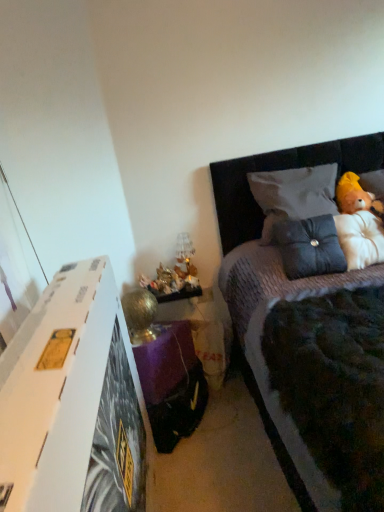
Measure the distance between point (18, 382) and camera.

They are 30.55 inches apart.

The height and width of the screenshot is (512, 384). Describe the element at coordinates (73, 402) in the screenshot. I see `white cardboard at left` at that location.

What do you see at coordinates (185, 255) in the screenshot?
I see `translucent glass lamp at lower center` at bounding box center [185, 255].

In order to face suede-like black pillow at upper right, which ranks as the second pillow in top-to-bottom order, should I rotate leftwards or rightwards?

You should look right and rotate roughly 15.401 degrees.

You are a GUI agent. You are given a task and a screenshot of the screen. Output one action in this format:
    pyautogui.click(x=<x>, y=<y>)
    Task: Click on the white cardboard at left
    Image resolution: width=384 pixels, height=512 pixels.
    Given the screenshot: What is the action you would take?
    pyautogui.click(x=73, y=402)

Is white cardboard at left further to the viewer compared to dark gray textured pillow at upper right, which is counted as the 1th pillow, starting from the top?

No, the depth of white cardboard at left is less than that of dark gray textured pillow at upper right, which is counted as the 1th pillow, starting from the top.

Considering the positions of point (139, 431) and point (271, 208), is point (139, 431) closer or farther from the camera than point (271, 208)?

Point (139, 431) appears to be closer to the viewer than point (271, 208).

Is white cardboard at left looking in the opposite direction of dark gray textured pillow at upper right, which is counted as the 1th pillow, starting from the top?

No.

From a real-world perspective, does white cardboard at left stand above dark gray textured pillow at upper right, which is counted as the 2th pillow, starting from the bottom?

Actually, white cardboard at left is physically below dark gray textured pillow at upper right, which is counted as the 2th pillow, starting from the bottom, in the real world.

Would you say fluffy white teddy bear at upper right is a long distance from translucent glass lamp at lower center?

No.

Between point (347, 174) and point (191, 267), which one is positioned behind?

The point (191, 267) is behind.

Looking at this image, is fluffy white teddy bear at upper right to the right of translucent glass lamp at lower center from the viewer's perspective?

Indeed, fluffy white teddy bear at upper right is positioned on the right side of translucent glass lamp at lower center.

Identify the location of lamp that is below the fluffy white teddy bear at upper right (from the image's perspective). (185, 255).

From a real-world perspective, which object stands above the other?

dark gray textured pillow at upper right, which is counted as the 1th pillow, starting from the top, from a real-world perspective.

Find the location of `the 2nd pillow directly above the translucent glass lamp at lower center (from a real-world perspective)`. the 2nd pillow directly above the translucent glass lamp at lower center (from a real-world perspective) is located at coordinates (296, 191).

Which is less distant, (190,266) or (290,185)?

Point (190,266).

Is fluffy white teddy bear at upper right far away from dark gray textured pillow at upper right, which is counted as the 2th pillow, starting from the bottom?

No, fluffy white teddy bear at upper right is not far away from dark gray textured pillow at upper right, which is counted as the 2th pillow, starting from the bottom.

Which object is further away from the camera taking this photo, fluffy white teddy bear at upper right or dark gray textured pillow at upper right, which is counted as the 2th pillow, starting from the bottom?

dark gray textured pillow at upper right, which is counted as the 2th pillow, starting from the bottom, is behind.

How many degrees apart are the facing directions of fluffy white teddy bear at upper right and dark gray textured pillow at upper right, which is counted as the 1th pillow, starting from the top?

The angular difference between fluffy white teddy bear at upper right and dark gray textured pillow at upper right, which is counted as the 1th pillow, starting from the top, is 0.0244 degrees.

At what (x,y) coordinates should I click in order to perform the action: click on pillow behind the fluffy white teddy bear at upper right. Please return your answer as a coordinate pair (x, y). Looking at the image, I should click on (296, 191).

Does translucent glass lamp at lower center have a larger size compared to velvet grey bed at upper right?

Actually, translucent glass lamp at lower center might be smaller than velvet grey bed at upper right.

Between translucent glass lamp at lower center and velvet grey bed at upper right, which one is positioned in front?

Positioned in front is velvet grey bed at upper right.

Is translucent glass lamp at lower center oriented towards velvet grey bed at upper right?

No.

From the image's perspective, who appears lower, fluffy white teddy bear at upper right or suede-like black pillow at upper right, positioned as the 1th pillow in bottom-to-top order?

suede-like black pillow at upper right, positioned as the 1th pillow in bottom-to-top order, is shown below in the image.

Is fluffy white teddy bear at upper right directly adjacent to suede-like black pillow at upper right, which ranks as the second pillow in top-to-bottom order?

They are not placed beside each other.

Could you tell me if fluffy white teddy bear at upper right is turned towards suede-like black pillow at upper right, positioned as the 1th pillow in bottom-to-top order?

No, fluffy white teddy bear at upper right is not aimed at suede-like black pillow at upper right, positioned as the 1th pillow in bottom-to-top order.

Is point (321, 240) behind point (181, 262)?

No, it is in front of (181, 262).

From the image's perspective, which one is positioned higher, suede-like black pillow at upper right, which ranks as the second pillow in top-to-bottom order, or translucent glass lamp at lower center?

suede-like black pillow at upper right, which ranks as the second pillow in top-to-bottom order, from the image's perspective.

Which pillow is the 1st one when counting from the right side of the translucent glass lamp at lower center? Please provide its 2D coordinates.

[(309, 247)]

Can you tell me how much suede-like black pillow at upper right, which ranks as the second pillow in top-to-bottom order, and translucent glass lamp at lower center differ in facing direction?

There is a 1.36-degree angle between the facing directions of suede-like black pillow at upper right, which ranks as the second pillow in top-to-bottom order, and translucent glass lamp at lower center.

Identify the location of nightstand in front of the dark gray textured pillow at upper right, which is counted as the 1th pillow, starting from the top. The height and width of the screenshot is (512, 384). (73, 402).

Where is `doll located above the translucent glass lamp at lower center (from a real-world perspective)`? The image size is (384, 512). doll located above the translucent glass lamp at lower center (from a real-world perspective) is located at coordinates (358, 224).

Which object lies nearer to the anchor point translucent glass lamp at lower center, dark gray textured pillow at upper right, which is counted as the 2th pillow, starting from the bottom, or velvet grey bed at upper right?

velvet grey bed at upper right is positioned closer to the anchor translucent glass lamp at lower center.

When comparing their distances from white cardboard at left, does fluffy white teddy bear at upper right or velvet grey bed at upper right seem closer?

velvet grey bed at upper right lies closer to white cardboard at left than the other object.

Considering their positions, is white cardboard at left positioned closer to translucent glass lamp at lower center than suede-like black pillow at upper right, which ranks as the second pillow in top-to-bottom order?

suede-like black pillow at upper right, which ranks as the second pillow in top-to-bottom order.

Based on their spatial positions, is fluffy white teddy bear at upper right or suede-like black pillow at upper right, which ranks as the second pillow in top-to-bottom order, further from dark gray textured pillow at upper right, which is counted as the 2th pillow, starting from the bottom?

Based on the image, fluffy white teddy bear at upper right appears to be further to dark gray textured pillow at upper right, which is counted as the 2th pillow, starting from the bottom.

Which object lies nearer to the anchor point white cardboard at left, translucent glass lamp at lower center or fluffy white teddy bear at upper right?

translucent glass lamp at lower center is closer to white cardboard at left.

Based on the photo, when comparing their distances from fluffy white teddy bear at upper right, does suede-like black pillow at upper right, which ranks as the second pillow in top-to-bottom order, or translucent glass lamp at lower center seem closer?

suede-like black pillow at upper right, which ranks as the second pillow in top-to-bottom order, is positioned closer to the anchor fluffy white teddy bear at upper right.

When comparing their distances from dark gray textured pillow at upper right, which is counted as the 2th pillow, starting from the bottom, does fluffy white teddy bear at upper right or white cardboard at left seem further?

white cardboard at left is positioned further to the anchor dark gray textured pillow at upper right, which is counted as the 2th pillow, starting from the bottom.

Estimate the real-world distances between objects in this image. Which object is further from fluffy white teddy bear at upper right, dark gray textured pillow at upper right, which is counted as the 2th pillow, starting from the bottom, or translucent glass lamp at lower center?

translucent glass lamp at lower center.

What are the coordinates of `pillow located between velvet grey bed at upper right and fluffy white teddy bear at upper right in the depth direction` in the screenshot? It's located at (309, 247).

I want to click on pillow situated between suede-like black pillow at upper right, positioned as the 1th pillow in bottom-to-top order, and fluffy white teddy bear at upper right from left to right, so click(x=296, y=191).

The height and width of the screenshot is (512, 384). Identify the location of nightstand located between velvet grey bed at upper right and suede-like black pillow at upper right, which ranks as the second pillow in top-to-bottom order, in the depth direction. (73, 402).

Where is `doll positioned between velvet grey bed at upper right and translucent glass lamp at lower center from near to far`? This screenshot has height=512, width=384. doll positioned between velvet grey bed at upper right and translucent glass lamp at lower center from near to far is located at coordinates (358, 224).